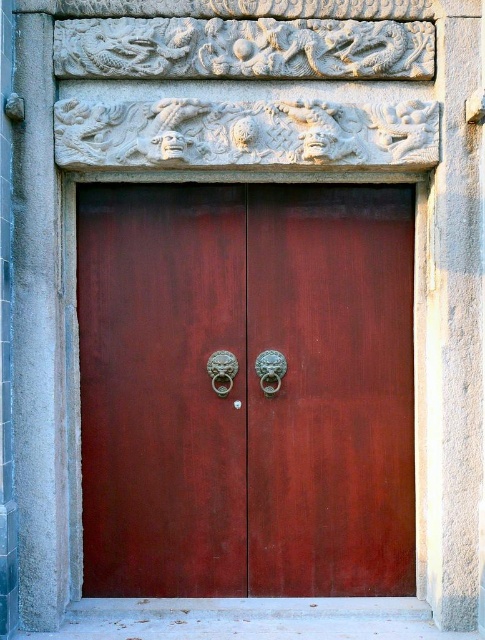
You are a painter standing in front of the doors. You want to paint the green metallic lion head at center but need to know its position relative to the glossy wood door at center. Which object is on the right side?

The green metallic lion head at center is on the right side of the glossy wood door at center.

You are standing in front of the doors and want to locate the green metallic lion head at center. What are the coordinates where you should look?

The green metallic lion head at center is located at coordinates point [270,371].